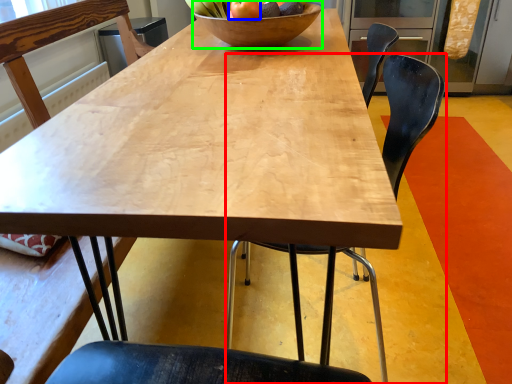
Question: Based on their relative distances, which object is nearer to chair (highlighted by a red box)? Choose from apple (highlighted by a blue box) and bowl (highlighted by a green box).

Choices:
 (A) apple
 (B) bowl

Answer: (B)